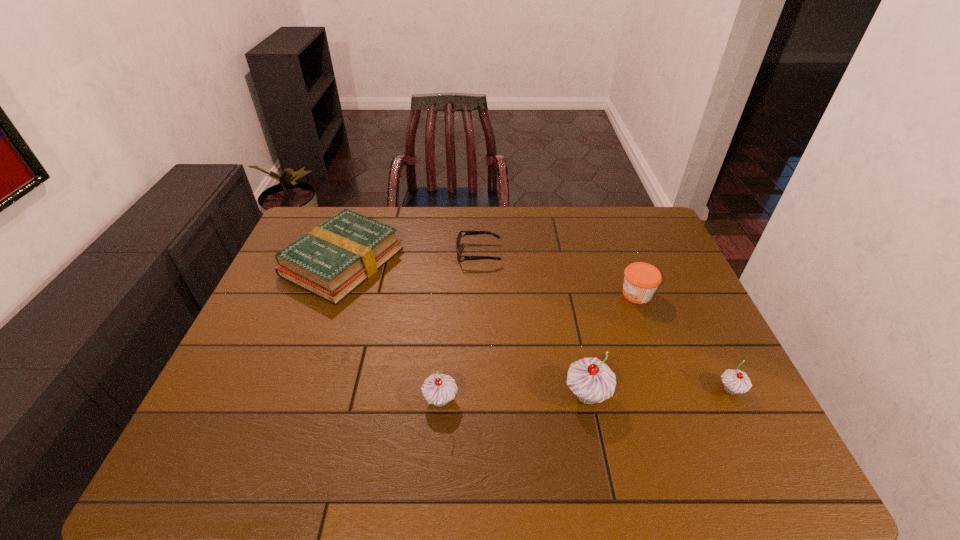
This screenshot has width=960, height=540. I want to click on unoccupied position between the tallest object and the leftmost cupcake, so click(514, 397).

The width and height of the screenshot is (960, 540). Identify the location of free space between the second tallest object and the hardback book. (392, 331).

This screenshot has height=540, width=960. I want to click on free space between the shortest object and the second object from right to left, so click(558, 274).

Find the location of a particular element. empty location between the tallest cupcake and the jam is located at coordinates (612, 345).

What are the coordinates of `vacant space in between the leftmost object and the third object from right to left` in the screenshot? It's located at (465, 328).

I want to click on blank region between the third object from right to left and the jam, so click(612, 345).

The width and height of the screenshot is (960, 540). Identify the location of vacant area between the rightmost object and the hardback book. (537, 326).

Locate which object ranks in proximity to the shortest object. Please provide its 2D coordinates. Your answer should be formatted as a tuple, i.e. [(x, y)], where the tuple contains the x and y coordinates of a point satisfying the conditions above.

[(332, 260)]

Where is `object that is the second closest to the hardback book`? object that is the second closest to the hardback book is located at coordinates (438, 389).

Locate an element on the screen. The height and width of the screenshot is (540, 960). cupcake object that ranks as the closest to the sunglasses is located at coordinates tap(591, 380).